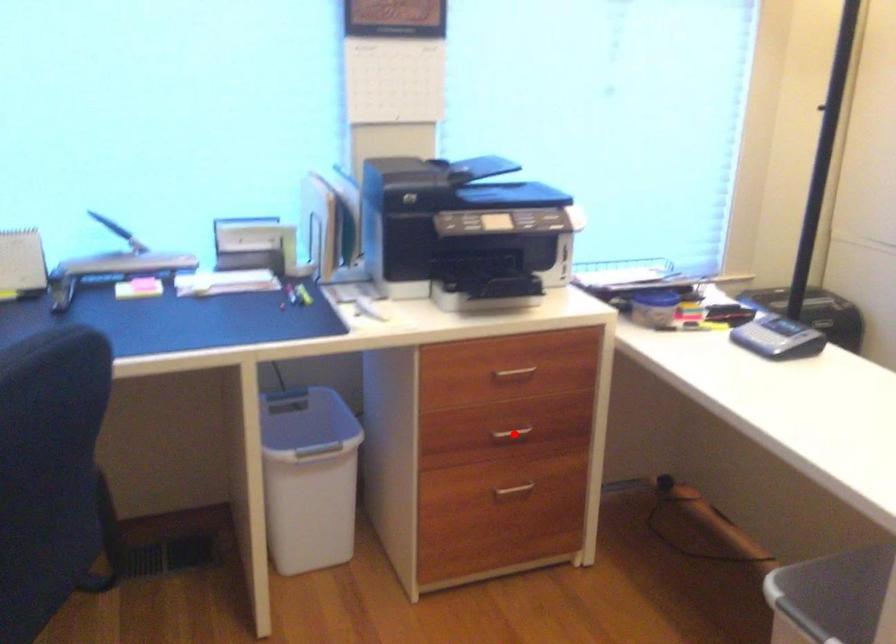
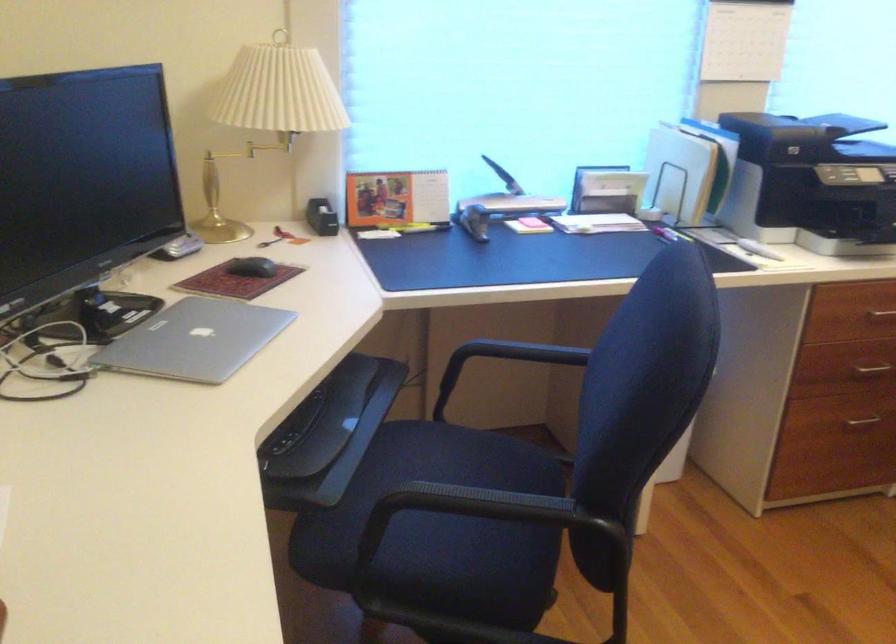
In the second image, find the point that corresponds to the highlighted location in the first image.

(869, 370)